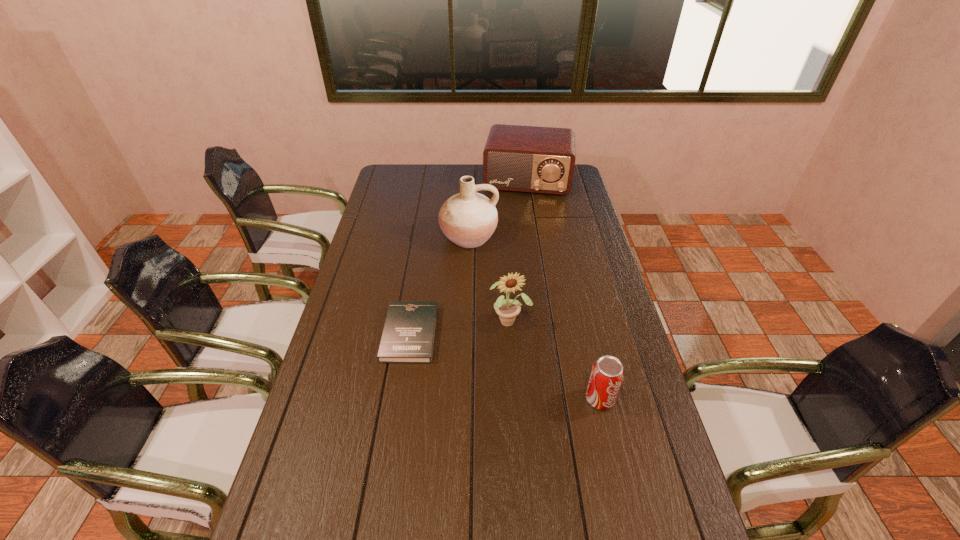
Identify the location of free space on the desktop that is between the shortest object and the soda can and is positioned to pour from the handle of the fourth nearest object. Image resolution: width=960 pixels, height=540 pixels. (478, 357).

Identify the location of free space on the desktop that is between the shortest object and the nearest object and is positioned on the front panel of the farthest object. (503, 366).

The image size is (960, 540). Identify the location of vacant space on the desktop that is between the shortest object and the soda can and is positioned on the front-facing side of the sunflower. (524, 373).